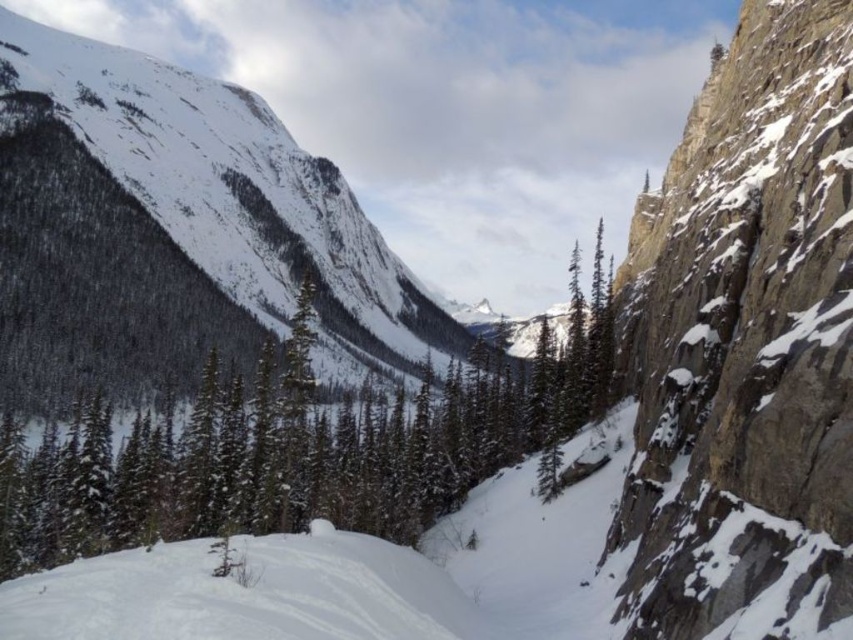
You are standing at the bottom of the valley and want to reach the point marked at coordinate point (746, 348). Based on the scene description, which side of the valley should you head towards?

The point marked at coordinate point (746, 348) is located on the rocky cliff at right, so you should head towards the rocky cliffs on the right side of the valley to reach it.

You are a photographer standing in the valley and want to capture both the point at coordinates point (270, 285) and point (451, 474) in your shot. Which point will appear closer to the front of your photo?

Point (270, 285) is further to the camera than point (451, 474), so it will appear closer to the front of your photo.

You are standing at the valley floor and want to locate the green textured pine tree at center. According to the coordinates provided, in which direction should you move from your current position to reach it?

The green textured pine tree at center is located at coordinates point (302, 448). Since you are at the valley floor, you should move towards the center of the valley where the coordinates indicate the pine tree is situated.